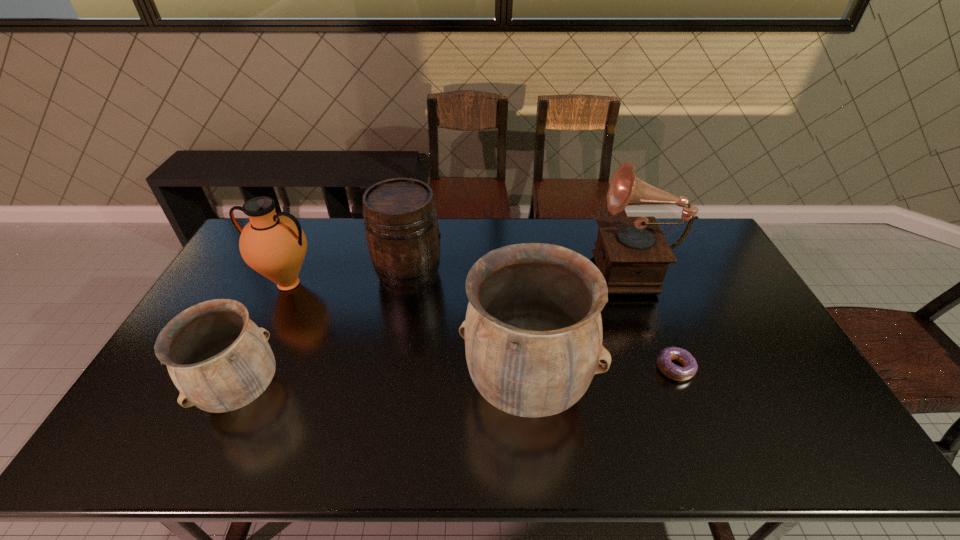
Please point out where to position a new urn on the right to maintain spacing. Please provide its 2D coordinates. Your answer should be formatted as a tuple, i.e. [(x, y)], where the tuple contains the x and y coordinates of a point satisfying the conditions above.

[(805, 381)]